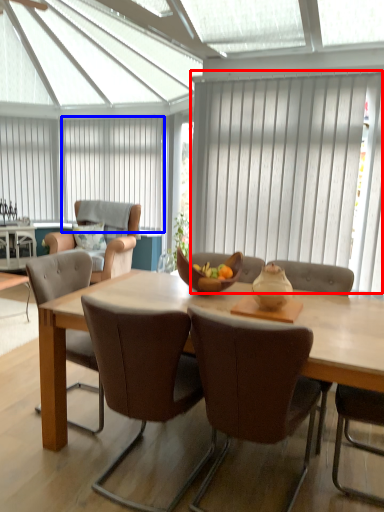
Question: Which object is further to the camera taking this photo, curtain (highlighted by a red box) or curtain (highlighted by a blue box)?

Choices:
 (A) curtain
 (B) curtain

Answer: (B)